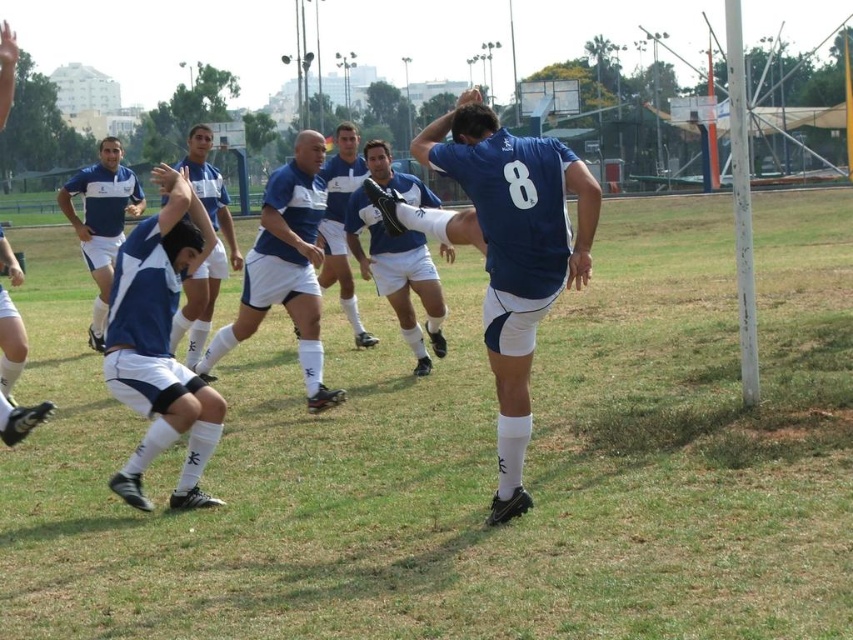
Question: Is the position of matte blue shirt at center less distant than that of blue matte soccer player at center?

Choices:
 (A) no
 (B) yes

Answer: (A)

Question: Where is green grass at center located in relation to matte blue jersey at center in the image?

Choices:
 (A) left
 (B) right

Answer: (A)

Question: Is green grass at center further to the viewer compared to matte blue shorts at center?

Choices:
 (A) no
 (B) yes

Answer: (A)

Question: Among these objects, which one is nearest to the camera?

Choices:
 (A) blue jersey at center
 (B) matte blue shirt at center
 (C) blue matte soccer player at center

Answer: (A)

Question: Which point is closer to the camera?

Choices:
 (A) blue matte shorts at center
 (B) blue matte uniform at center
 (C) matte blue shirt at center
 (D) blue jersey at center

Answer: (D)

Question: Estimate the real-world distances between objects in this image. Which object is closer to the blue matte uniform at center?

Choices:
 (A) matte blue shorts at center
 (B) green grass at center
 (C) blue matte shorts at center
 (D) blue jersey at center

Answer: (D)